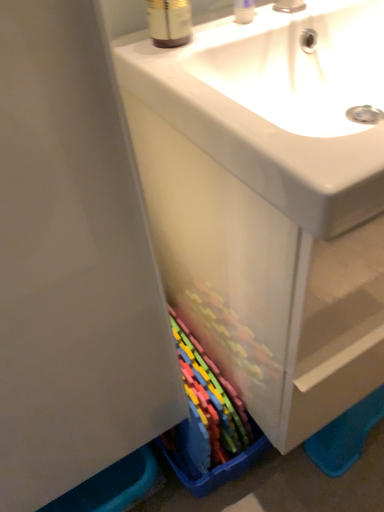
The width and height of the screenshot is (384, 512). What do you see at coordinates (169, 22) in the screenshot? I see `brown plastic bottle at upper center` at bounding box center [169, 22].

Identify the location of clear plastic container at upper center. This screenshot has height=512, width=384. (244, 11).

Considering the sizes of objects clear plastic container at upper center and matte plastic cabinet at center in the image provided, who is smaller, clear plastic container at upper center or matte plastic cabinet at center?

clear plastic container at upper center.

The width and height of the screenshot is (384, 512). I want to click on bathroom cabinet below the clear plastic container at upper center (from a real-world perspective), so click(x=270, y=201).

Is clear plastic container at upper center in front of matte plastic cabinet at center?

No.

How many degrees apart are the facing directions of clear plastic container at upper center and matte plastic cabinet at center?

The angular difference between clear plastic container at upper center and matte plastic cabinet at center is 39.2 degrees.

Is matte plastic cabinet at center facing away from clear plastic container at upper center?

matte plastic cabinet at center does not have its back to clear plastic container at upper center.

Measure the distance between matte plastic cabinet at center and clear plastic container at upper center.

matte plastic cabinet at center is 14.57 inches from clear plastic container at upper center.

Considering the sizes of objects matte plastic cabinet at center and clear plastic container at upper center in the image provided, who is thinner, matte plastic cabinet at center or clear plastic container at upper center?

Thinner between the two is clear plastic container at upper center.

Considering the sizes of matte plastic cabinet at center and clear plastic container at upper center in the image, is matte plastic cabinet at center bigger or smaller than clear plastic container at upper center?

Considering their sizes, matte plastic cabinet at center takes up more space than clear plastic container at upper center.

Does matte plastic cabinet at center have a greater height compared to brown plastic bottle at upper center?

Indeed, matte plastic cabinet at center has a greater height compared to brown plastic bottle at upper center.

Based on the photo, could you tell me if matte plastic cabinet at center is turned towards brown plastic bottle at upper center?

No.

Is point (328, 54) less distant than point (178, 7)?

No, it is behind (178, 7).

Looking at the image, does matte plastic cabinet at center seem bigger or smaller compared to brown plastic bottle at upper center?

Clearly, matte plastic cabinet at center is larger in size than brown plastic bottle at upper center.

Between clear plastic container at upper center and brown plastic bottle at upper center, which one has more height?

With more height is brown plastic bottle at upper center.

From the picture: Which is behind, clear plastic container at upper center or brown plastic bottle at upper center?

clear plastic container at upper center.

Does clear plastic container at upper center touch brown plastic bottle at upper center?

No, clear plastic container at upper center is not making contact with brown plastic bottle at upper center.

From a real-world perspective, is clear plastic container at upper center positioned above or below brown plastic bottle at upper center?

clear plastic container at upper center is situated lower than brown plastic bottle at upper center in the real world.

In terms of width, does brown plastic bottle at upper center look wider or thinner when compared to clear plastic container at upper center?

In the image, brown plastic bottle at upper center appears to be wider than clear plastic container at upper center.

From the image's perspective, is brown plastic bottle at upper center below clear plastic container at upper center?

Yes, from the image's perspective, brown plastic bottle at upper center is beneath clear plastic container at upper center.

Based on their sizes in the image, would you say brown plastic bottle at upper center is bigger or smaller than clear plastic container at upper center?

Clearly, brown plastic bottle at upper center is larger in size than clear plastic container at upper center.

How far apart are brown plastic bottle at upper center and matte plastic cabinet at center?

brown plastic bottle at upper center and matte plastic cabinet at center are 12.66 inches apart from each other.

Is brown plastic bottle at upper center situated inside matte plastic cabinet at center or outside?

brown plastic bottle at upper center is spatially situated outside matte plastic cabinet at center.

In the scene shown: Is brown plastic bottle at upper center oriented towards matte plastic cabinet at center?

No.

Is brown plastic bottle at upper center taller or shorter than matte plastic cabinet at center?

Considering their sizes, brown plastic bottle at upper center has less height than matte plastic cabinet at center.

Where is `bathroom cabinet located below the clear plastic container at upper center (from the image's perspective)`? bathroom cabinet located below the clear plastic container at upper center (from the image's perspective) is located at coordinates (270, 201).

Identify the location of bathroom cabinet on the right of the clear plastic container at upper center. (270, 201).

Estimate the real-world distances between objects in this image. Which object is further from clear plastic container at upper center, brown plastic bottle at upper center or matte plastic cabinet at center?

matte plastic cabinet at center is positioned further to the anchor clear plastic container at upper center.

Based on the photo, considering their positions, is matte plastic cabinet at center positioned further to clear plastic container at upper center than brown plastic bottle at upper center?

matte plastic cabinet at center.

From the picture: Which object lies nearer to the anchor point brown plastic bottle at upper center, matte plastic cabinet at center or clear plastic container at upper center?

Based on the image, clear plastic container at upper center appears to be nearer to brown plastic bottle at upper center.

Which object lies further to the anchor point matte plastic cabinet at center, brown plastic bottle at upper center or clear plastic container at upper center?

clear plastic container at upper center is positioned further to the anchor matte plastic cabinet at center.

Looking at the image, which one is located closer to brown plastic bottle at upper center, clear plastic container at upper center or matte plastic cabinet at center?

The object closer to brown plastic bottle at upper center is clear plastic container at upper center.

Considering their positions, is clear plastic container at upper center positioned closer to matte plastic cabinet at center than brown plastic bottle at upper center?

brown plastic bottle at upper center is closer to matte plastic cabinet at center.

Identify the location of mouthwash between clear plastic container at upper center and matte plastic cabinet at center from top to bottom. The height and width of the screenshot is (512, 384). (169, 22).